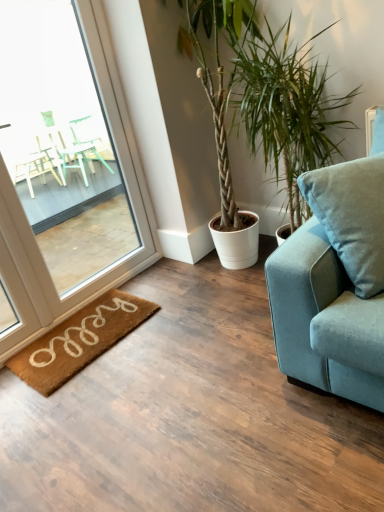
Where is `empty space that is ontop of brown coir mat at lower left`? empty space that is ontop of brown coir mat at lower left is located at coordinates (91, 326).